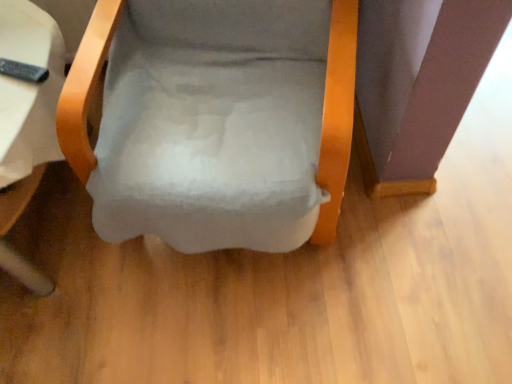
What do you see at coordinates (337, 116) in the screenshot? This screenshot has height=384, width=512. I see `suede-like gray chair at center` at bounding box center [337, 116].

The height and width of the screenshot is (384, 512). I want to click on suede-like gray chair at center, so click(x=337, y=116).

Where is `suede-like gray chair at center`? suede-like gray chair at center is located at coordinates (337, 116).